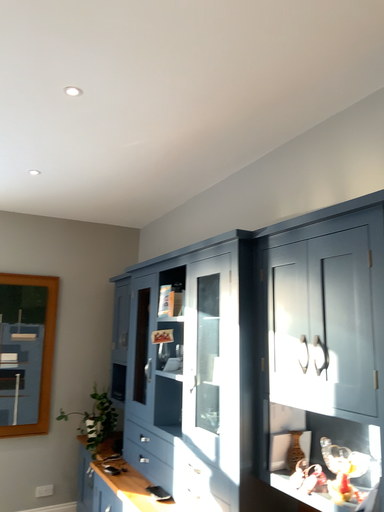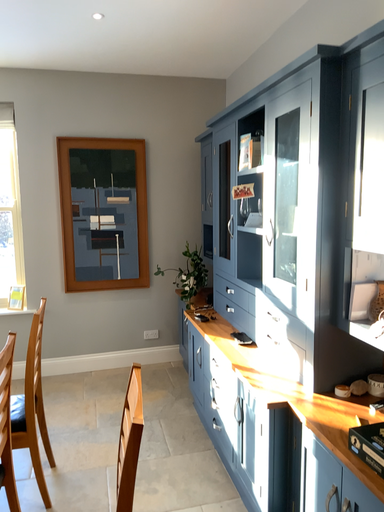
Question: How did the camera likely rotate when shooting the video?

Choices:
 (A) rotated right
 (B) rotated left

Answer: (B)